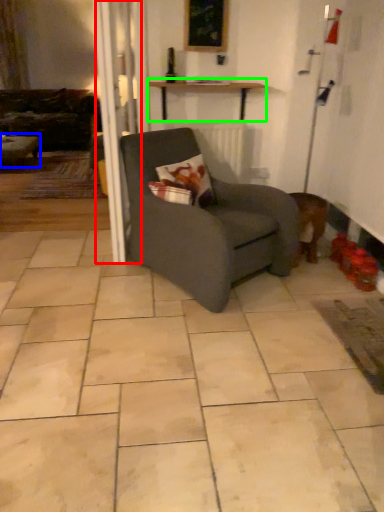
Question: Which object is positioned farthest from screen door (highlighted by a red box)? Select from table (highlighted by a blue box) and table (highlighted by a green box).

Choices:
 (A) table
 (B) table

Answer: (A)